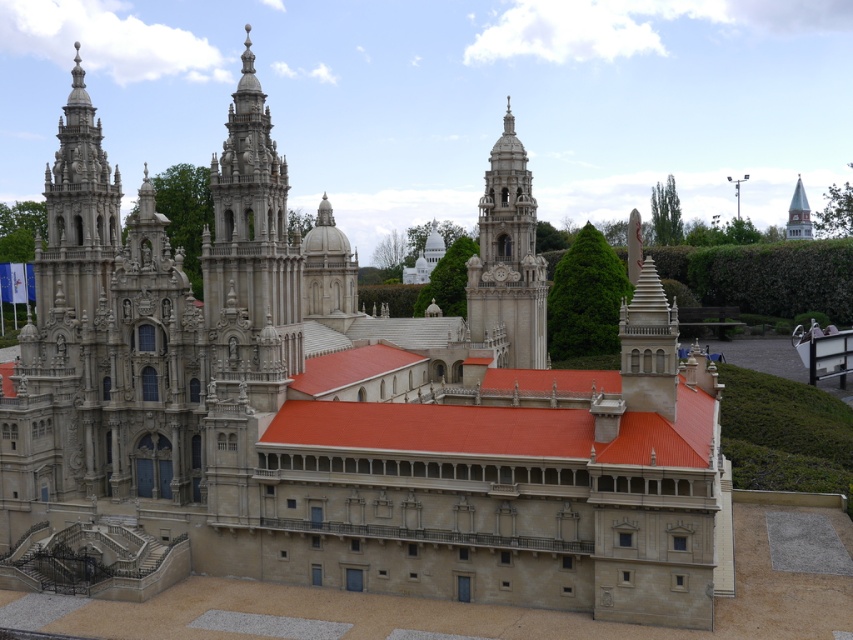
The height and width of the screenshot is (640, 853). What are the coordinates of `smooth stone tower at center` in the screenshot? It's located at tap(250, 227).

Can you confirm if smooth stone tower at center is wider than white stone tower at left?

No.

Is point (294, 308) farther from camera compared to point (83, 227)?

No, (294, 308) is in front of (83, 227).

This screenshot has width=853, height=640. In order to click on smooth stone tower at center in this screenshot , I will do `click(250, 227)`.

Which of these two, smooth stone tower at center or white stone clock tower at center, stands taller?

white stone clock tower at center is taller.

Where is `smooth stone tower at center`? This screenshot has height=640, width=853. smooth stone tower at center is located at coordinates (250, 227).

Is point (283, 305) behind point (521, 147)?

No.

Identify the location of smooth stone tower at center. (250, 227).

Is white stone tower at left to the right of white stone clock tower at center from the viewer's perspective?

No, white stone tower at left is not to the right of white stone clock tower at center.

Which of these two, white stone tower at left or white stone clock tower at center, stands taller?

white stone clock tower at center is taller.

The width and height of the screenshot is (853, 640). Find the location of `white stone tower at left`. white stone tower at left is located at coordinates (77, 218).

Where is `white stone tower at left`? white stone tower at left is located at coordinates (77, 218).